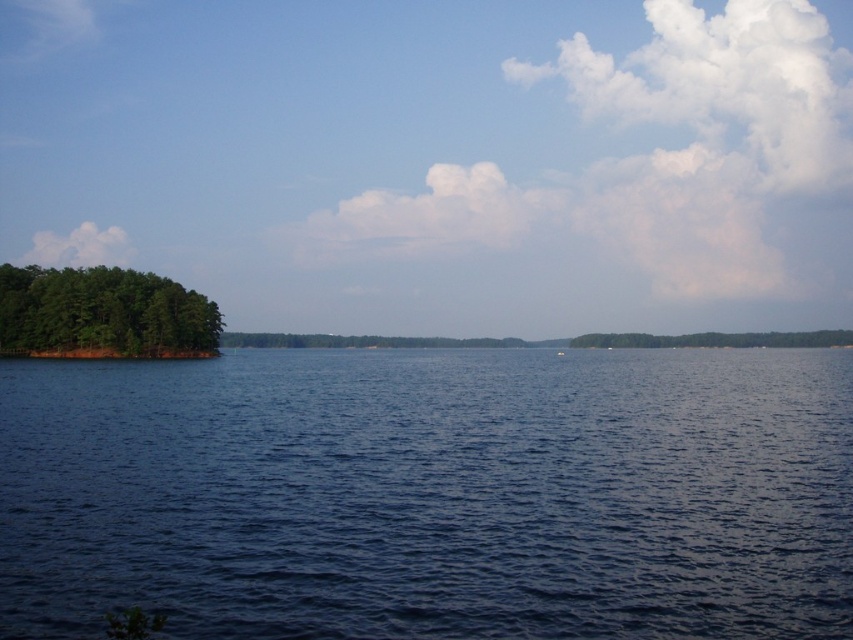
Does white fluffy cloud at upper center appear under white plastic boat at center?

No, white fluffy cloud at upper center is not below white plastic boat at center.

Who is lower down, white fluffy cloud at upper center or white plastic boat at center?

white plastic boat at center

Between point (329, 252) and point (563, 353), which one is positioned behind?

The point (329, 252) is more distant.

Locate an element on the screen. white fluffy cloud at upper center is located at coordinates (425, 216).

Where is `white fluffy cloud at upper right`? white fluffy cloud at upper right is located at coordinates (727, 83).

Is point (735, 28) closer to camera compared to point (430, 172)?

No, (735, 28) is behind (430, 172).

The image size is (853, 640). In order to click on white fluffy cloud at upper right in this screenshot , I will do `click(727, 83)`.

Does point (816, 339) lie in front of point (42, 250)?

Yes.

Is green matte tree at center behind white fluffy cloud at upper left?

That is False.

Who is more forward, (834, 340) or (119, 234)?

Point (834, 340) is more forward.

Identify the location of green matte tree at center. (717, 339).